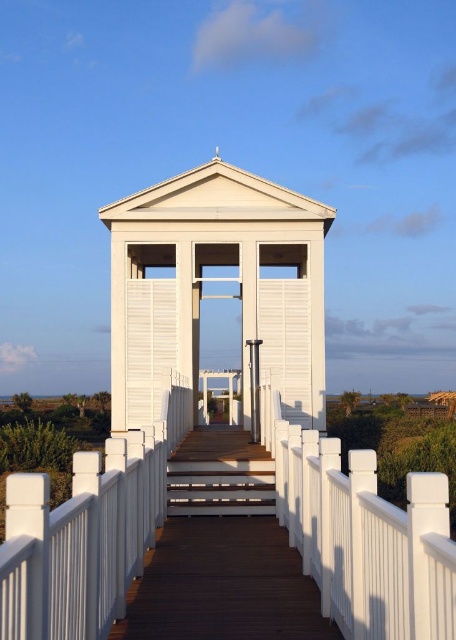
Between wooden deck at center and brown wooden stairs at center, which one is positioned higher?

Positioned higher is wooden deck at center.

Between wooden deck at center and brown wooden stairs at center, which one appears on the left side from the viewer's perspective?

From the viewer's perspective, brown wooden stairs at center appears more on the left side.

What do you see at coordinates (222, 554) in the screenshot?
I see `wooden deck at center` at bounding box center [222, 554].

At what (x,y) coordinates should I click in order to perform the action: click on wooden deck at center. Please return your answer as a coordinate pair (x, y). The image size is (456, 640). Looking at the image, I should click on (222, 554).

Which of these two, white matte gazebo at center or brown wooden stairs at center, stands shorter?

brown wooden stairs at center is shorter.

Is white matte gazebo at center taller than brown wooden stairs at center?

Indeed, white matte gazebo at center has a greater height compared to brown wooden stairs at center.

Locate an element on the screen. The height and width of the screenshot is (640, 456). white matte gazebo at center is located at coordinates (216, 282).

Does white matte gazebo at center appear on the right side of wooden deck at center?

Incorrect, white matte gazebo at center is not on the right side of wooden deck at center.

Between point (274, 321) and point (216, 518), which one is positioned in front?

Point (216, 518) is more forward.

Which is behind, point (123, 413) or point (207, 621)?

The point (123, 413) is more distant.

Where is `white matte gazebo at center`? The height and width of the screenshot is (640, 456). white matte gazebo at center is located at coordinates (216, 282).